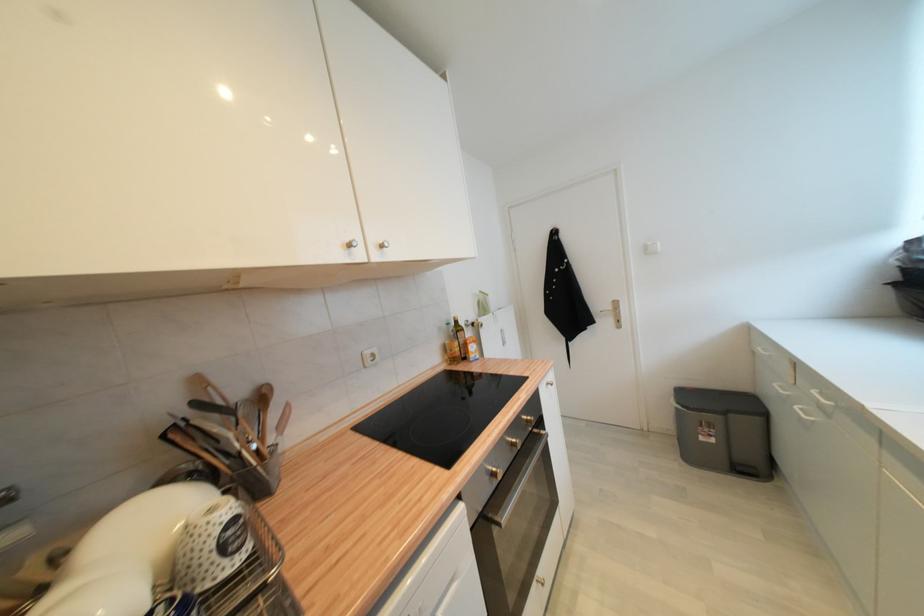
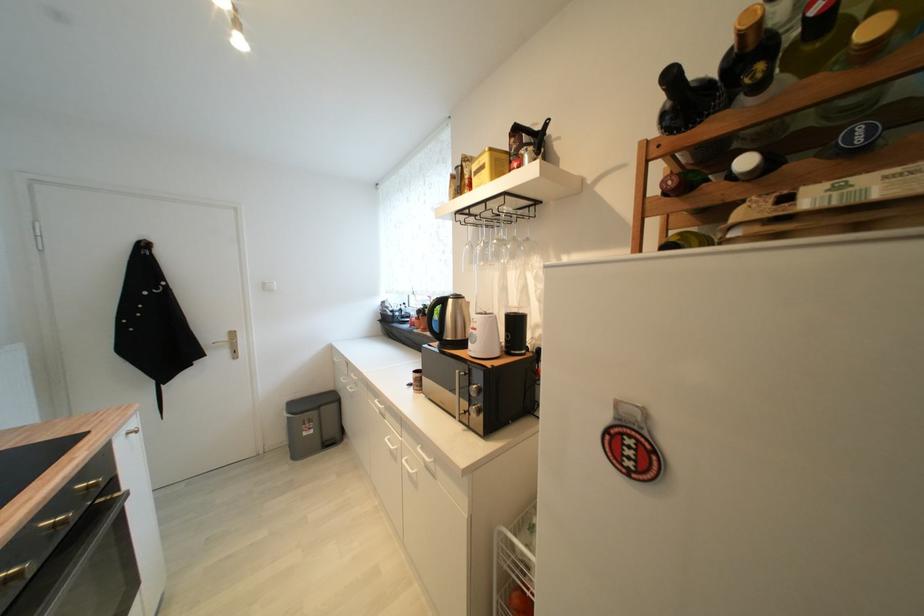
Question: The images are taken continuously from a first-person perspective. In which direction is your viewpoint rotating?

Choices:
 (A) Left
 (B) Right
 (C) Up
 (D) Down

Answer: (B)